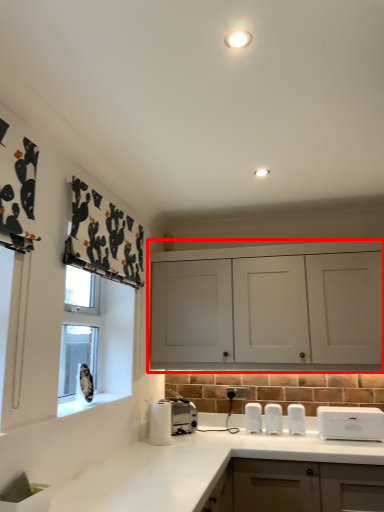
Question: Where is cabinetry (annotated by the red box) located in relation to countertop in the image?

Choices:
 (A) right
 (B) left

Answer: (A)